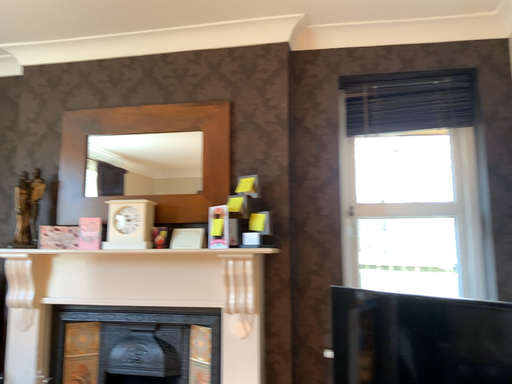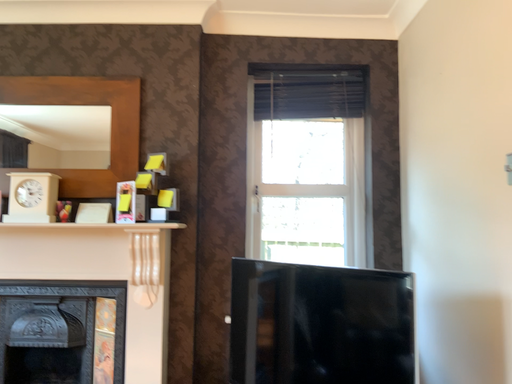
Question: Which way did the camera rotate in the video?

Choices:
 (A) rotated left
 (B) rotated right

Answer: (B)